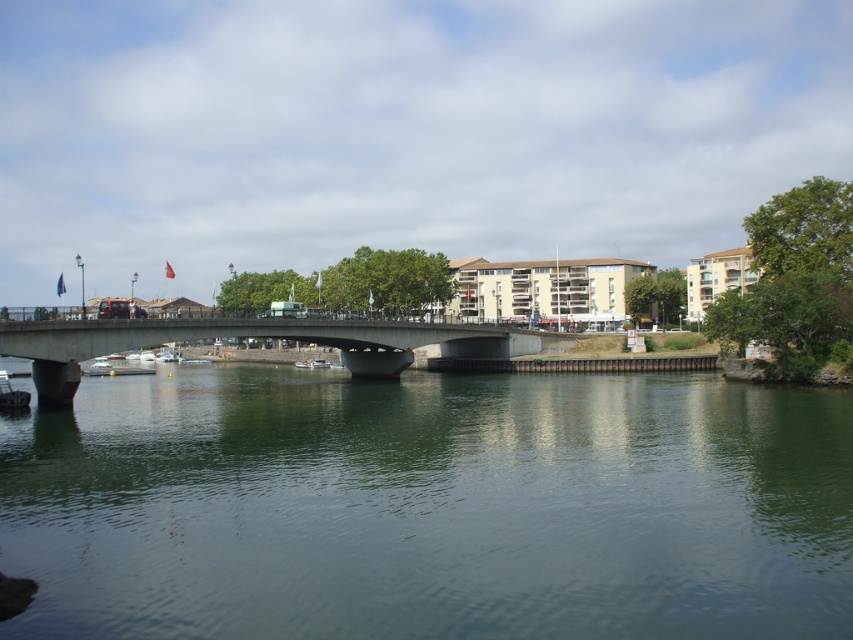
You are standing on the riverbank and want to cross to the other side. The concrete bridge at center is in your path. Can you see the green smooth water at center from where you are standing?

Yes, since the green smooth water at center is below the concrete bridge at center, you can see it from the riverbank while standing under the bridge.

From the picture: You are standing at the riverside looking at the scene. There are two points marked in the image, point 1 at coordinates point (567, 577) and point 2 at coordinates point (47, 333). Which point is nearer to your viewpoint?

Point (567, 577) is closer to the camera than point (47, 333), so point 1 is nearer to your viewpoint.